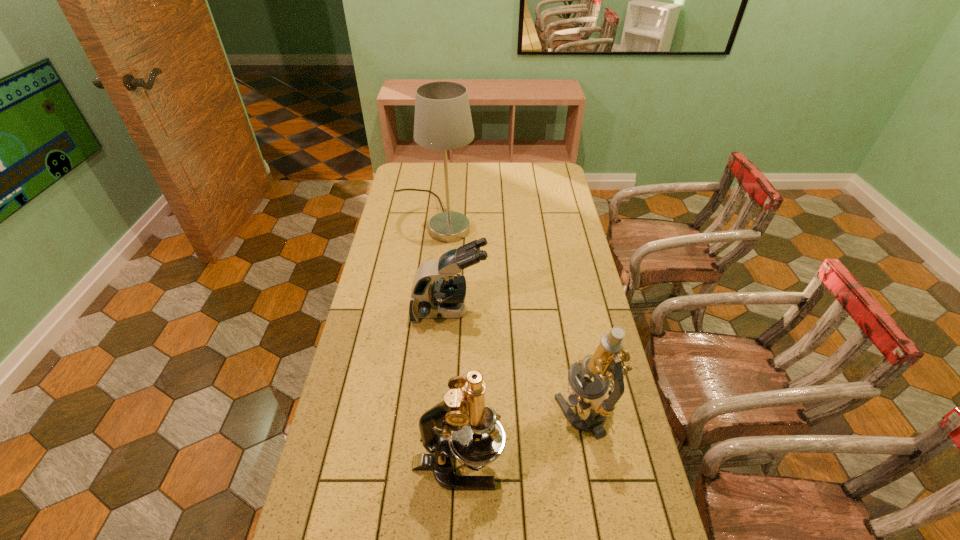
Find the location of a particular element. table lamp is located at coordinates (442, 121).

At what (x,y) coordinates should I click in order to perform the action: click on the tallest object. Please return your answer as a coordinate pair (x, y). Looking at the image, I should click on (442, 121).

Locate an element on the screen. This screenshot has width=960, height=540. the rightmost object is located at coordinates (605, 365).

You are a GUI agent. You are given a task and a screenshot of the screen. Output one action in this format:
    pyautogui.click(x=<x>, y=<y>)
    Task: Click on the shortest object
    The height and width of the screenshot is (540, 960).
    Given the screenshot: What is the action you would take?
    pyautogui.click(x=436, y=293)

I want to click on the third nearest object, so click(436, 293).

I want to click on free location located 0.200m on the back of the farthest object, so click(x=439, y=169).

Image resolution: width=960 pixels, height=540 pixels. In order to click on vacant space located 0.380m on the back of the rightmost microscope in this screenshot , I will do coord(562,295).

The height and width of the screenshot is (540, 960). I want to click on vacant space located through the eyepieces of the shortest object, so click(x=526, y=311).

Identify the location of object located at the left edge. Image resolution: width=960 pixels, height=540 pixels. (442, 121).

This screenshot has width=960, height=540. I want to click on object that is positioned at the right edge, so click(605, 365).